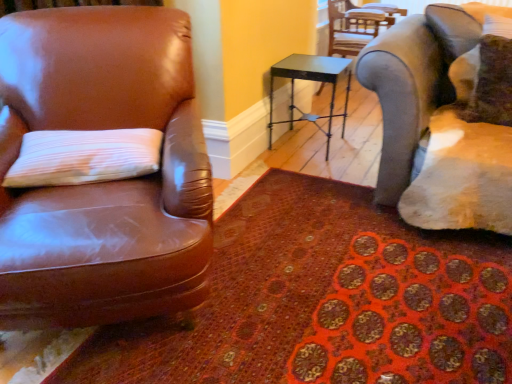
Question: Does metallic gray chair at upper right, the 2th chair positioned from the left, turn towards metallic black table at center?

Choices:
 (A) yes
 (B) no

Answer: (B)

Question: Is metallic black table at center completely or partially inside metallic gray chair at upper right, acting as the first chair starting from the right?

Choices:
 (A) no
 (B) yes

Answer: (A)

Question: Are metallic gray chair at upper right, the 2th chair positioned from the left, and metallic black table at center located far from each other?

Choices:
 (A) yes
 (B) no

Answer: (B)

Question: From the image's perspective, does metallic gray chair at upper right, the 2th chair ordered from the bottom, appear lower than metallic black table at center?

Choices:
 (A) yes
 (B) no

Answer: (B)

Question: Does metallic gray chair at upper right, acting as the first chair starting from the right, have a smaller size compared to metallic black table at center?

Choices:
 (A) no
 (B) yes

Answer: (A)

Question: In the image, is white textured pillow at left, which is the 1th pillow in front-to-back order, positioned in front of or behind velvet brown pillow at upper right, placed as the 2th pillow when sorted from left to right?

Choices:
 (A) front
 (B) behind

Answer: (A)

Question: In terms of height, does white textured pillow at left, positioned as the 1th pillow in left-to-right order, look taller or shorter compared to velvet brown pillow at upper right, arranged as the 2th pillow when viewed from the front?

Choices:
 (A) tall
 (B) short

Answer: (B)

Question: Is white textured pillow at left, positioned as the 2th pillow in right-to-left order, inside or outside of velvet brown pillow at upper right, arranged as the 2th pillow when viewed from the front?

Choices:
 (A) inside
 (B) outside

Answer: (B)

Question: From a real-world perspective, is white textured pillow at left, arranged as the second pillow when viewed from the top, physically located above or below velvet brown pillow at upper right, which appears as the first pillow when viewed from the right?

Choices:
 (A) above
 (B) below

Answer: (B)

Question: From the image's perspective, is metallic black table at center above or below metallic gray chair at upper right, the 1th chair viewed from the top?

Choices:
 (A) above
 (B) below

Answer: (B)

Question: Is point (343, 132) positioned closer to the camera than point (384, 16)?

Choices:
 (A) farther
 (B) closer

Answer: (B)

Question: Is metallic black table at center situated inside metallic gray chair at upper right, the 2th chair positioned from the left, or outside?

Choices:
 (A) inside
 (B) outside

Answer: (B)

Question: Considering the positions of metallic black table at center and metallic gray chair at upper right, the 2th chair positioned from the left, in the image, is metallic black table at center taller or shorter than metallic gray chair at upper right, the 2th chair positioned from the left,?

Choices:
 (A) short
 (B) tall

Answer: (A)

Question: Looking at their shapes, would you say patterned carpet at lower left is wider or thinner than brown leather chair at left, marked as the 1th chair in a bottom-to-top arrangement?

Choices:
 (A) wide
 (B) thin

Answer: (A)

Question: From their relative heights in the image, would you say patterned carpet at lower left is taller or shorter than brown leather chair at left, marked as the 1th chair in a bottom-to-top arrangement?

Choices:
 (A) tall
 (B) short

Answer: (B)